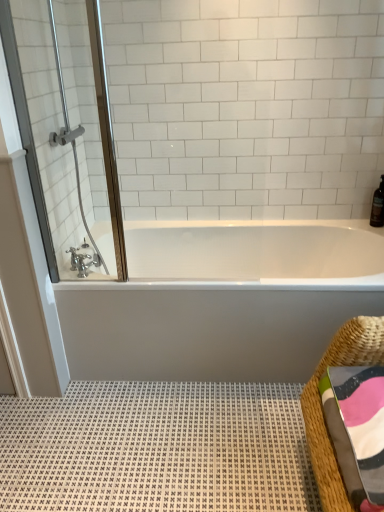
Question: From the image's perspective, is woven straw basket at lower right located beneath brown glass bottle at upper right?

Choices:
 (A) yes
 (B) no

Answer: (A)

Question: Can you confirm if woven straw basket at lower right is positioned to the left of brown glass bottle at upper right?

Choices:
 (A) yes
 (B) no

Answer: (A)

Question: From a real-world perspective, is woven straw basket at lower right located higher than brown glass bottle at upper right?

Choices:
 (A) yes
 (B) no

Answer: (B)

Question: Is brown glass bottle at upper right at the back of woven straw basket at lower right?

Choices:
 (A) no
 (B) yes

Answer: (A)

Question: Does woven straw basket at lower right have a smaller size compared to brown glass bottle at upper right?

Choices:
 (A) yes
 (B) no

Answer: (B)

Question: Is brown glass bottle at upper right taller or shorter than multicolored woven towel at lower right?

Choices:
 (A) short
 (B) tall

Answer: (B)

Question: Visually, is brown glass bottle at upper right positioned to the left or to the right of multicolored woven towel at lower right?

Choices:
 (A) left
 (B) right

Answer: (B)

Question: Is point coord(372,203) closer or farther from the camera than point coord(360,501)?

Choices:
 (A) closer
 (B) farther

Answer: (B)

Question: Considering their positions, is brown glass bottle at upper right located in front of or behind multicolored woven towel at lower right?

Choices:
 (A) behind
 (B) front

Answer: (A)

Question: Do you think clear glass shower door at upper left is within brown glass bottle at upper right, or outside of it?

Choices:
 (A) inside
 (B) outside

Answer: (B)

Question: Is clear glass shower door at upper left taller or shorter than brown glass bottle at upper right?

Choices:
 (A) tall
 (B) short

Answer: (A)

Question: Is clear glass shower door at upper left in front of or behind brown glass bottle at upper right in the image?

Choices:
 (A) behind
 (B) front

Answer: (B)

Question: Is point (91, 86) closer or farther from the camera than point (377, 196)?

Choices:
 (A) farther
 (B) closer

Answer: (B)

Question: Looking at the image, does brushed metal faucet at lower left seem bigger or smaller compared to white textured bath mat at lower center?

Choices:
 (A) small
 (B) big

Answer: (A)

Question: From a real-world perspective, is brushed metal faucet at lower left positioned above or below white textured bath mat at lower center?

Choices:
 (A) above
 (B) below

Answer: (A)